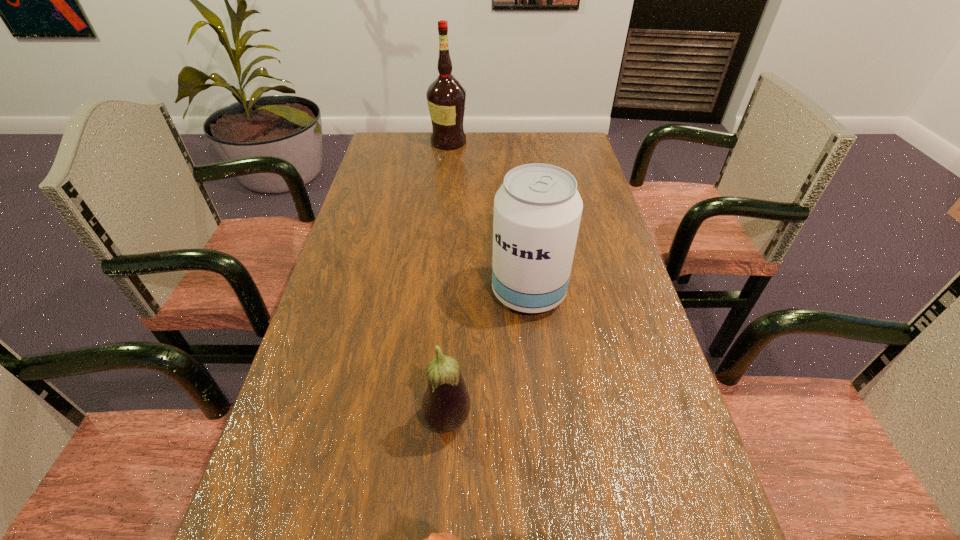
Identify the location of free location at the left edge of the desktop. (315, 322).

The height and width of the screenshot is (540, 960). Find the location of `free region at the right edge`. free region at the right edge is located at coordinates (608, 240).

This screenshot has width=960, height=540. In order to click on free space at the far left corner of the desktop in this screenshot , I will do `click(398, 140)`.

The width and height of the screenshot is (960, 540). I want to click on vacant region between the second tallest object and the third farthest object, so click(488, 357).

Locate an element on the screen. This screenshot has width=960, height=540. vacant area that lies between the right alcohol and the second nearest object is located at coordinates [x=488, y=357].

Where is `vacant space that's between the tallest object and the eggplant`? The width and height of the screenshot is (960, 540). vacant space that's between the tallest object and the eggplant is located at coordinates (448, 281).

Locate an element on the screen. Image resolution: width=960 pixels, height=540 pixels. free spot between the farthest object and the third farthest object is located at coordinates [448, 281].

At what (x,y) coordinates should I click in order to perform the action: click on object that is the closest one to the farther alcohol. Please return your answer as a coordinate pair (x, y). Looking at the image, I should click on point(537,210).

Identify which object is the third nearest to the farthest object. Please provide its 2D coordinates. Your answer should be formatted as a tuple, i.e. [(x, y)], where the tuple contains the x and y coordinates of a point satisfying the conditions above.

[(447, 539)]

I want to click on free space that satisfies the following two spatial constraints: 1. on the back side of the second farthest object; 2. on the right side of the eggplant, so click(454, 293).